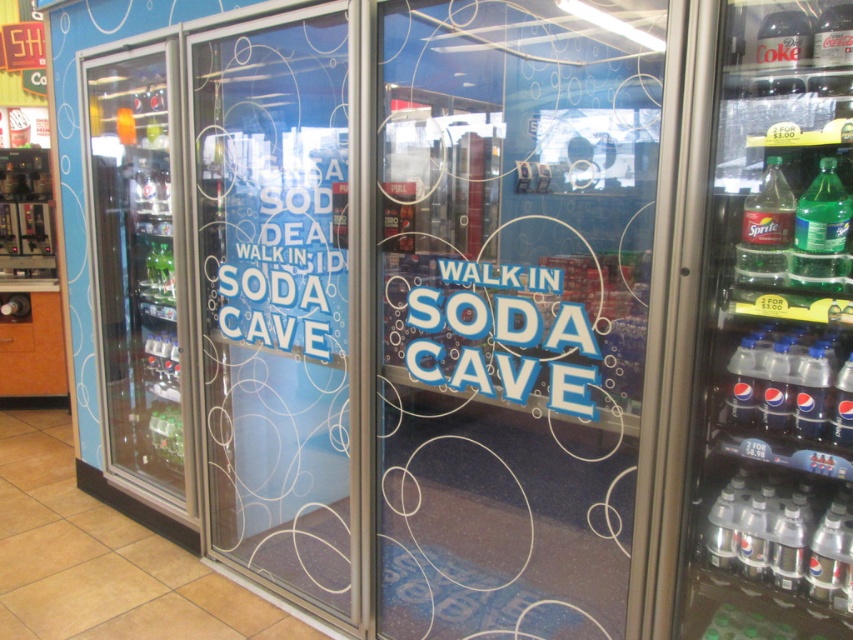
You are a delivery person who needs to place a new soda display case in the walk in soda cave. The display case is 7 feet long. There is a transparent plastic door at center and a camera. Can you fit the display case between them?

The transparent plastic door at center and camera are 7.01 feet apart from each other, so yes, the display case which is 7 feet long can fit between them since the distance is slightly more than the display case length.

You are a delivery person who needs to place a new shipment of clear plastic bottles at center right in the walk in soda cave entrance. According to the store layout, where should you place them?

The clear plastic bottles at center right should be placed at the position marked by the coordinates point (x=775, y=337).

You are a delivery person carrying a large box that is 2 meters wide. You need to move through the walk in soda cave entrance to place the box between the clear glass refrigerator at left and the clear plastic bottle at lower right. Can you fit the box between them?

The distance between the clear glass refrigerator at left and the clear plastic bottle at lower right is 2.22 meters. Since the box is 2 meters wide, it can fit between them as the space is wider than the box.